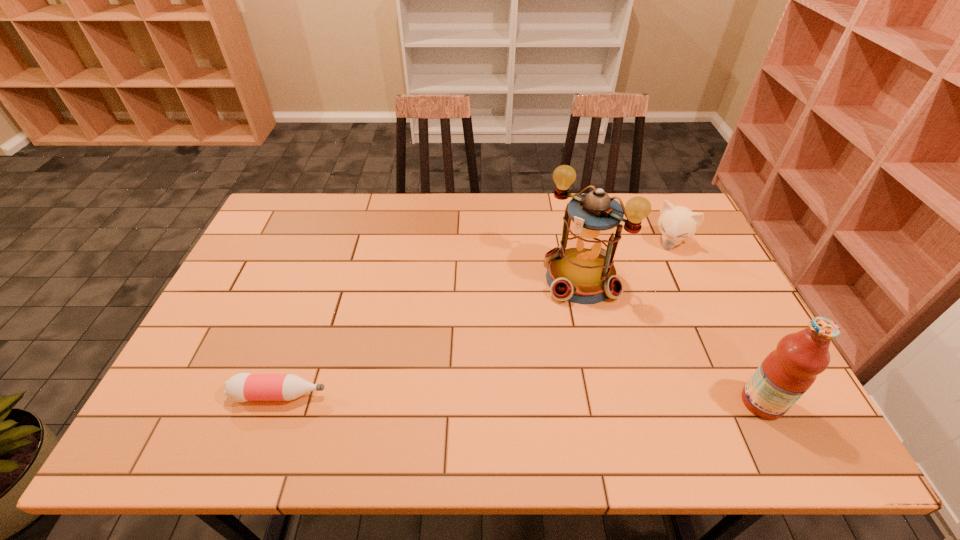
Locate an element on the screen. This screenshot has height=540, width=960. vacant space that's between the bottle and the tallest object is located at coordinates (430, 337).

Identify the location of free space between the kitten and the lantern. (625, 261).

Identify the location of vacant space in between the shortest object and the second object from left to right. The width and height of the screenshot is (960, 540). (430, 337).

In order to click on empty space between the third shortest object and the lantern in this screenshot , I will do `click(671, 340)`.

Where is `unoccupied position between the second object from left to right and the kitten`? unoccupied position between the second object from left to right and the kitten is located at coordinates (625, 261).

Image resolution: width=960 pixels, height=540 pixels. What are the coordinates of `free space between the second shortest object and the third shortest object` in the screenshot? It's located at (716, 322).

I want to click on vacant point located between the tallest object and the second shortest object, so (x=625, y=261).

I want to click on vacant area that lies between the bottle and the lantern, so click(430, 337).

Locate which object ranks third in proximity to the lantern. Please provide its 2D coordinates. Your answer should be formatted as a tuple, i.e. [(x, y)], where the tuple contains the x and y coordinates of a point satisfying the conditions above.

[(242, 387)]

Point out which object is positioned as the second nearest to the fruit juice. Please provide its 2D coordinates. Your answer should be formatted as a tuple, i.e. [(x, y)], where the tuple contains the x and y coordinates of a point satisfying the conditions above.

[(677, 223)]